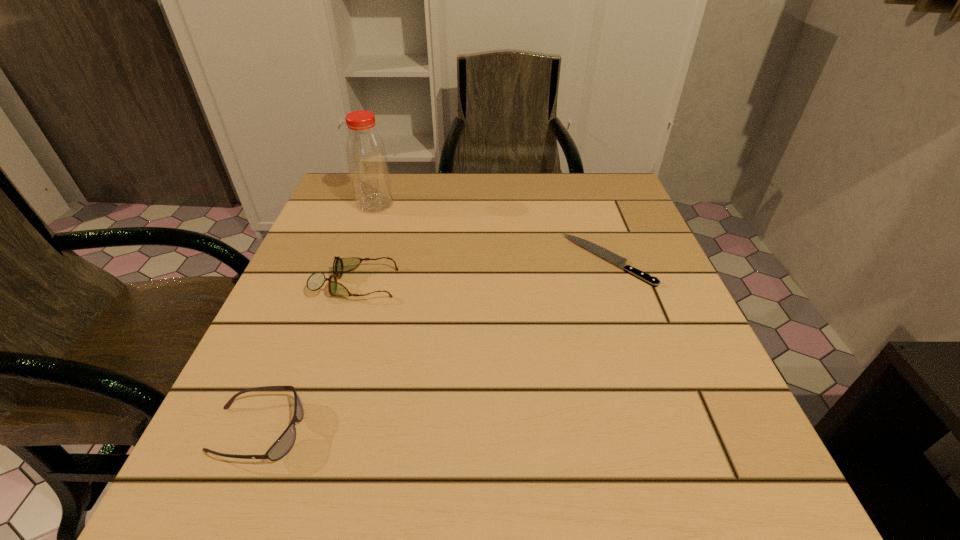
Where is `bottle`? bottle is located at coordinates (366, 155).

At what (x,y) coordinates should I click in order to perform the action: click on the tallest object. Please return your answer as a coordinate pair (x, y). The height and width of the screenshot is (540, 960). Looking at the image, I should click on (366, 155).

Find the location of a particular element. spectacles is located at coordinates (316, 280).

Locate an element on the screen. The image size is (960, 540). sunglasses is located at coordinates (281, 447).

Locate an element on the screen. the shortest object is located at coordinates (606, 254).

Identify the location of steak knife. (606, 254).

You are a GUI agent. You are given a task and a screenshot of the screen. Output one action in this format:
    pyautogui.click(x=<x>, y=<y>)
    Task: Click on the free location located on the front of the bottle
    This screenshot has height=540, width=960.
    Given the screenshot: What is the action you would take?
    pyautogui.click(x=327, y=346)

This screenshot has width=960, height=540. Find the location of `vacant space situated 0.190m on the front-facing side of the spectacles`. vacant space situated 0.190m on the front-facing side of the spectacles is located at coordinates (494, 284).

Locate an element on the screen. The height and width of the screenshot is (540, 960). free space located 0.320m on the lenses of the nearest object is located at coordinates (530, 431).

What are the coordinates of `vacant region located on the back of the rightmost object` in the screenshot? It's located at (593, 218).